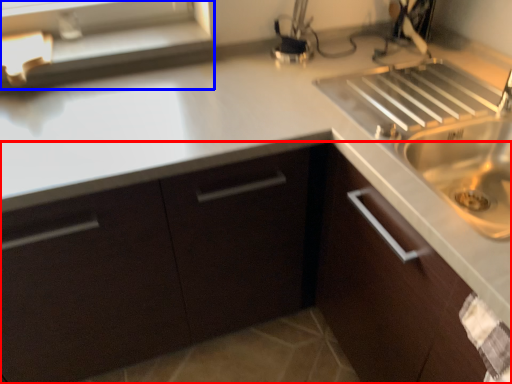
Question: Which point is closer to the camera, cabinetry (highlighted by a red box) or window sill (highlighted by a blue box)?

Choices:
 (A) cabinetry
 (B) window sill

Answer: (A)